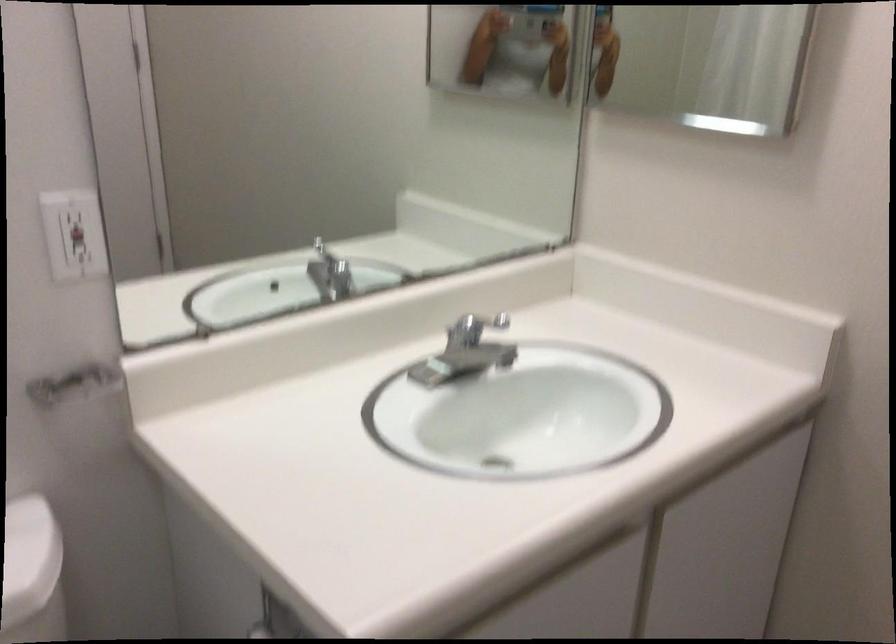
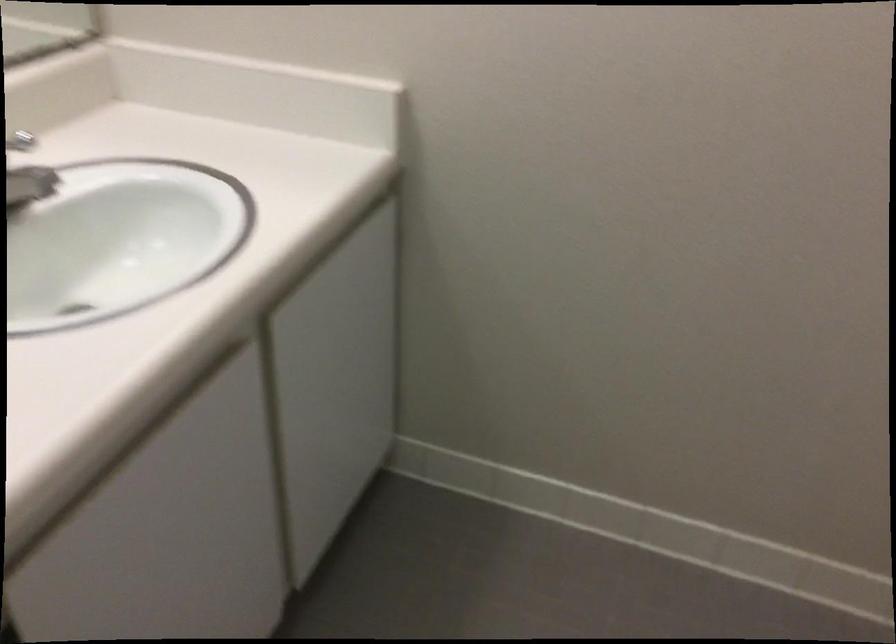
The images are taken continuously from a first-person perspective. In which direction is your viewpoint rotating?

The camera's rotation is toward right-down.